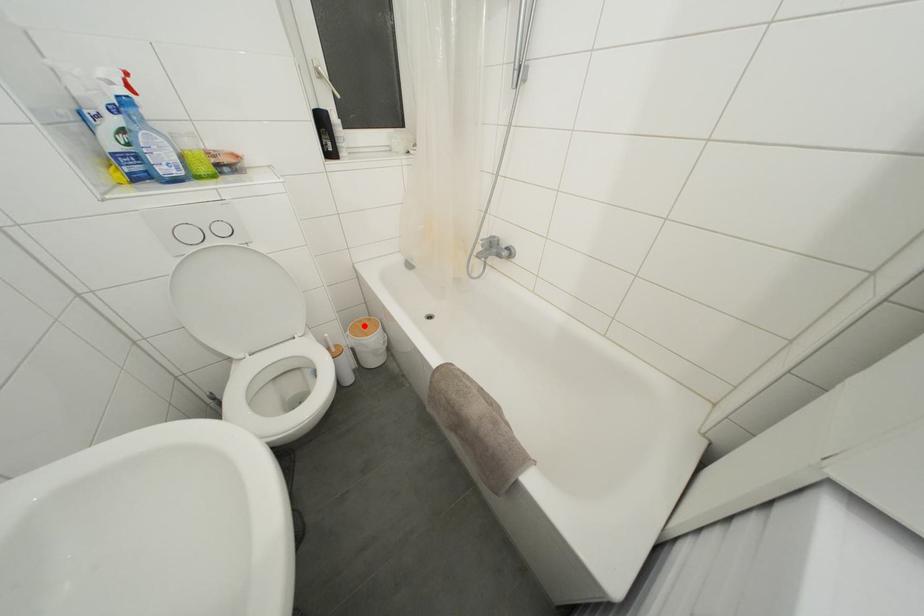
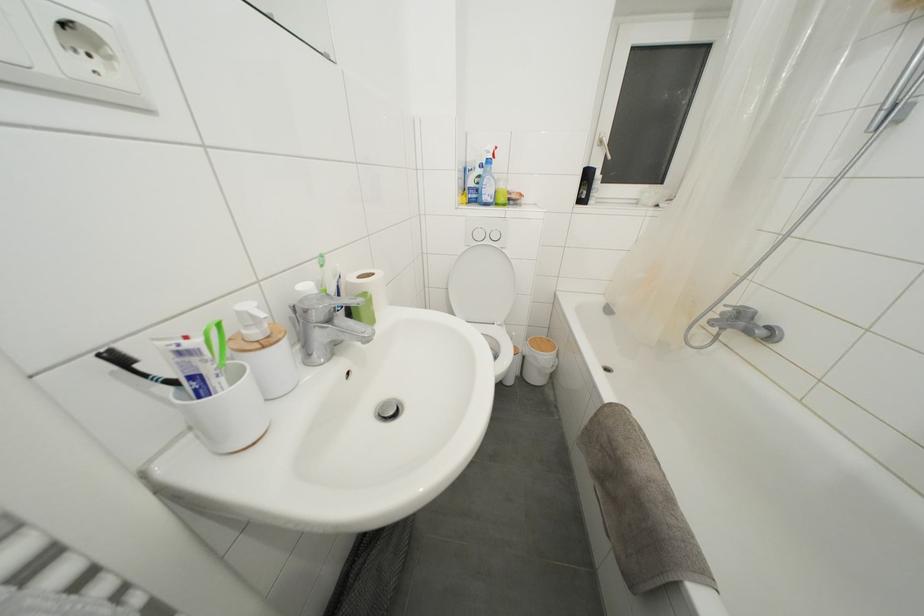
The point at the highlighted location is marked in the first image. Where is the corresponding point in the second image?

(544, 342)